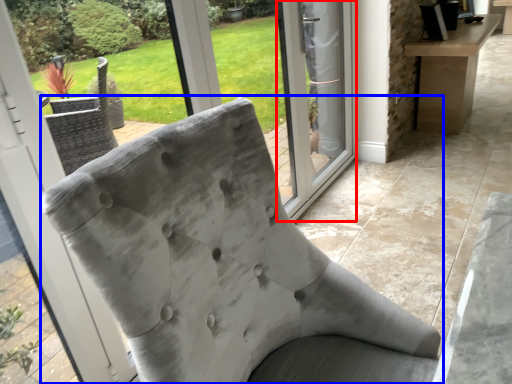
Question: Which of the following is the farthest to the observer, screen door (highlighted by a red box) or chair (highlighted by a blue box)?

Choices:
 (A) screen door
 (B) chair

Answer: (A)